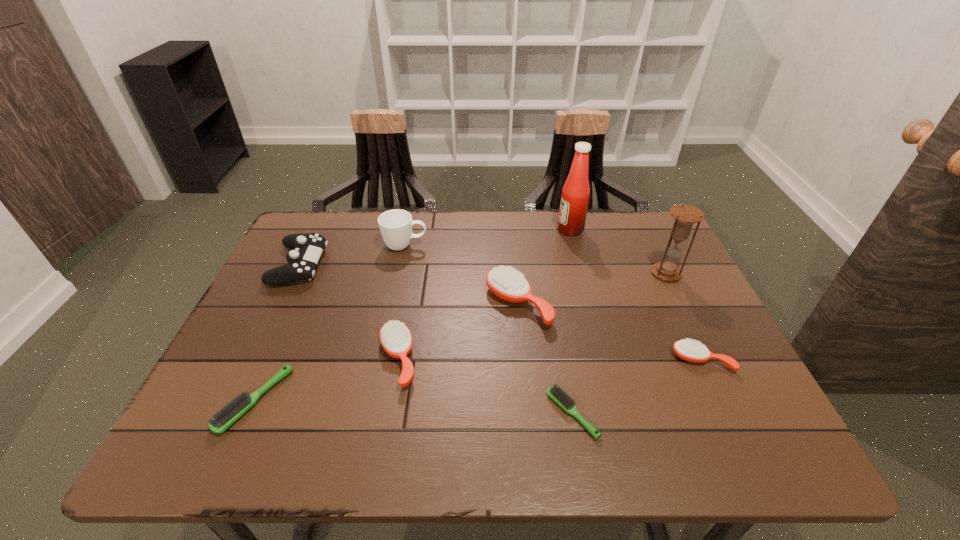
I want to click on vacant region between the hourglass and the tallest hairbrush, so click(x=592, y=289).

Select which object is the sixth closest to the second biggest orange hairbrush. Please provide its 2D coordinates. Your answer should be formatted as a tuple, i.e. [(x, y)], where the tuple contains the x and y coordinates of a point satisfying the conditions above.

[(575, 194)]

The image size is (960, 540). Identify the location of the third closest object to the biggest orange hairbrush. (395, 225).

I want to click on hairbrush that is the third closest to the hourglass, so click(554, 392).

The height and width of the screenshot is (540, 960). I want to click on the third closest hairbrush to the rightmost orange hairbrush, so click(395, 337).

Where is `the second closest orange hairbrush to the cup`? The image size is (960, 540). the second closest orange hairbrush to the cup is located at coordinates point(395,337).

Image resolution: width=960 pixels, height=540 pixels. Identify the location of the third closest orange hairbrush to the seventh shortest object. (693, 351).

Locate an element on the screen. This screenshot has width=960, height=540. vacant point that satisfies the following two spatial constraints: 1. on the front side of the fourth hairbrush from right to left; 2. on the right side of the smallest orange hairbrush is located at coordinates (397, 360).

Locate an element on the screen. vacant point that satisfies the following two spatial constraints: 1. with the handle on the side of the tallest hairbrush; 2. on the right side of the third tallest object is located at coordinates (393, 304).

Locate an element on the screen. The image size is (960, 540). vacant point that satisfies the following two spatial constraints: 1. on the back side of the bigger light hairbrush; 2. on the right side of the tallest hairbrush is located at coordinates (298, 304).